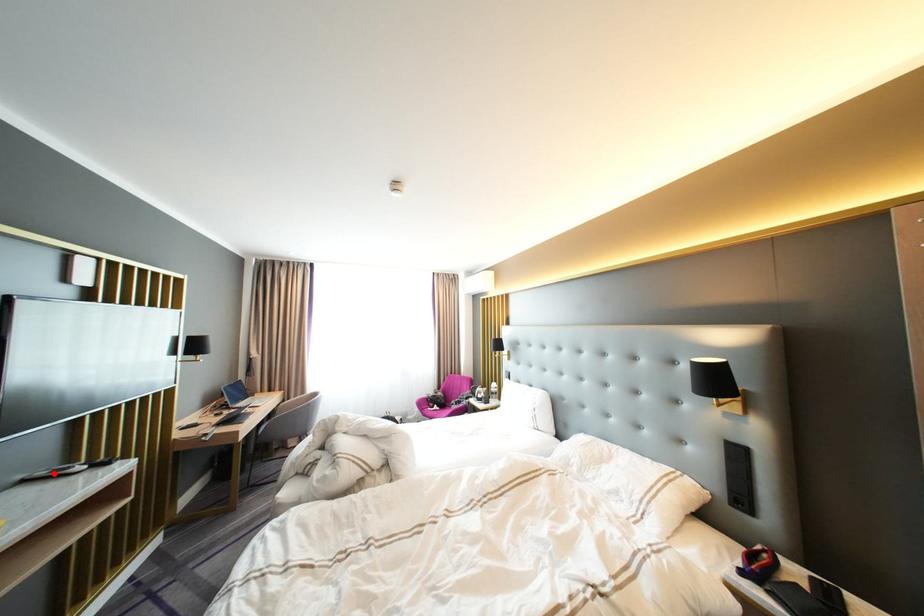
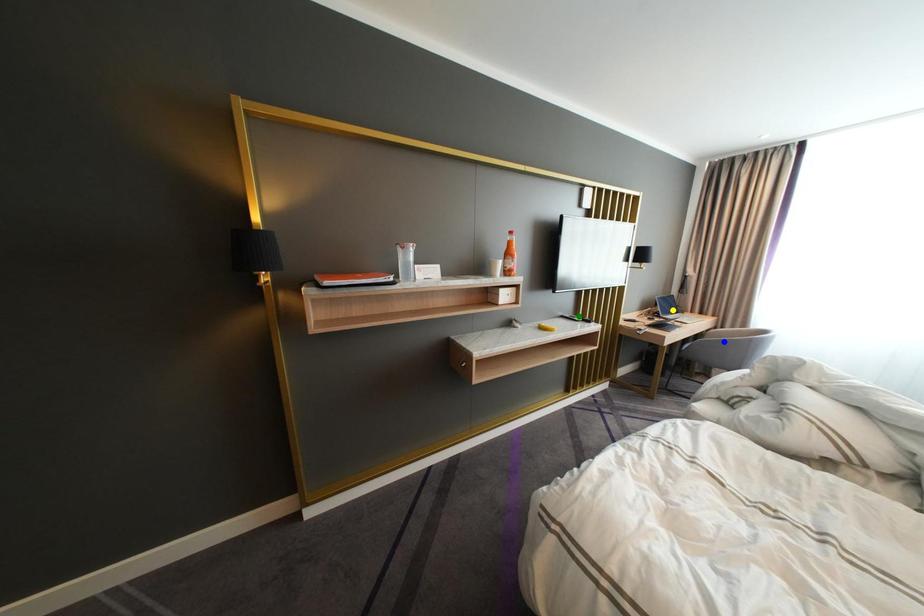
Question: I am providing you with two images of the same scene from different viewpoints. A red point is marked on the first image. You are given multiple points on the second image. Can you choose the point in image 2 that corresponds to the point in image 1?

Choices:
 (A) blue point
 (B) green point
 (C) yellow point

Answer: (B)